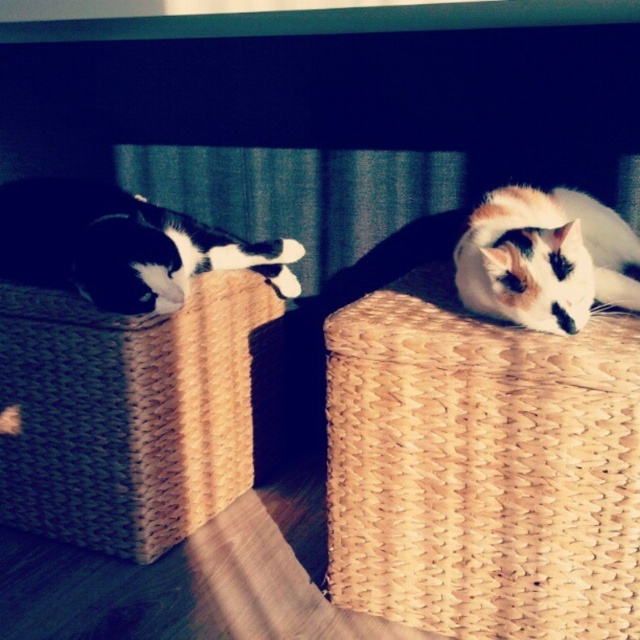
You are a cat owner who wants to ensure both cats have enough space to stretch comfortably in their baskets. Given that the woven straw basket at left and calico fur cat at right are the two baskets available, which basket should you choose for the larger cat?

The woven straw basket at left is larger in size than the calico fur cat at right, so the larger cat should be placed in the woven straw basket at left to ensure enough space for stretching.